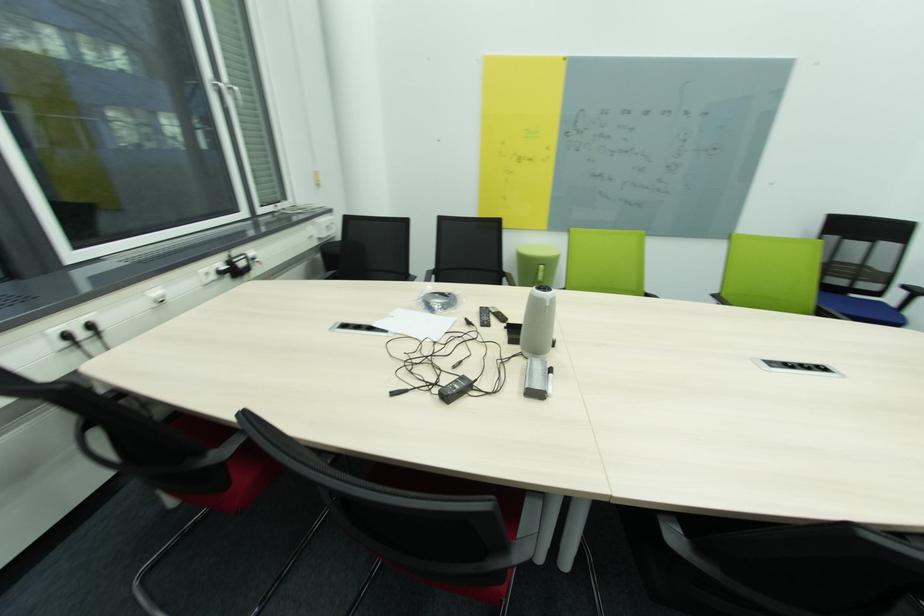
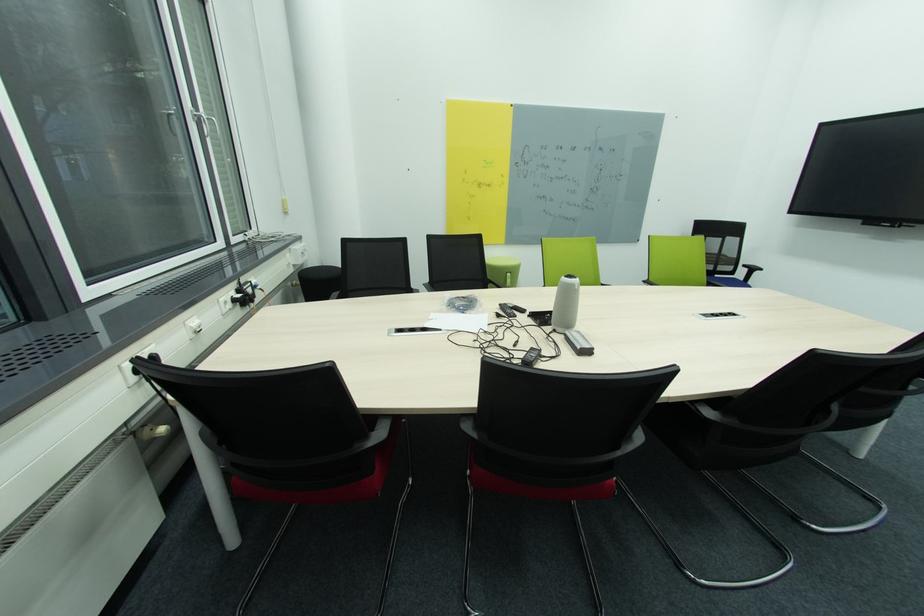
The point at (x=541, y=387) is marked in the first image. Where is the corresponding point in the second image?

(591, 347)